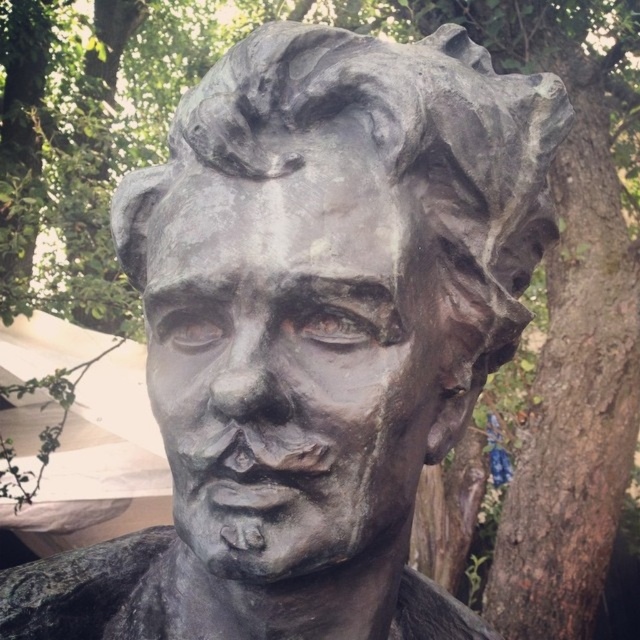
Question: Which object is closer to the camera taking this photo?

Choices:
 (A) bronze statue at center
 (B) bronze sculpture at center

Answer: (B)

Question: Is bronze statue at center bigger than bronze sculpture at center?

Choices:
 (A) yes
 (B) no

Answer: (A)

Question: Where is bronze statue at center located in relation to bronze sculpture at center in the image?

Choices:
 (A) below
 (B) above

Answer: (B)

Question: Which of the following is the farthest from the observer?

Choices:
 (A) bronze statue at center
 (B) bronze sculpture at center

Answer: (A)

Question: Can you confirm if bronze statue at center is positioned to the left of bronze sculpture at center?

Choices:
 (A) yes
 (B) no

Answer: (B)